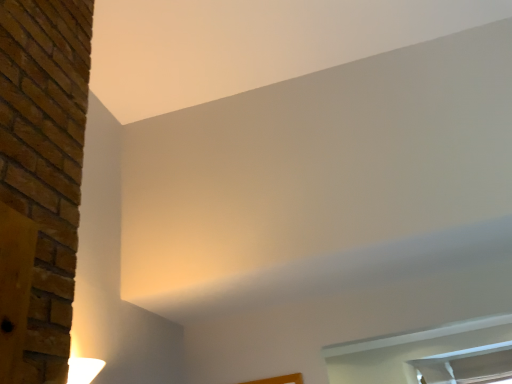
Describe the element at coordinates (429, 355) in the screenshot. Image resolution: width=512 pixels, height=384 pixels. I see `clear glass window at lower right, acting as the second window starting from the bottom` at that location.

The width and height of the screenshot is (512, 384). In order to click on clear glass window at lower right, acting as the second window starting from the bottom in this screenshot , I will do `click(429, 355)`.

Identify the location of clear glass window at lower right, marked as the first window in a bottom-to-top arrangement. (467, 365).

The width and height of the screenshot is (512, 384). What do you see at coordinates (467, 365) in the screenshot? I see `clear glass window at lower right, the 2th window from the top` at bounding box center [467, 365].

Locate an element on the screen. The image size is (512, 384). clear glass window at lower right, acting as the second window starting from the bottom is located at coordinates (429, 355).

Which object is positioned more to the right, clear glass window at lower right, acting as the second window starting from the bottom, or clear glass window at lower right, the 2th window from the top?

clear glass window at lower right, the 2th window from the top, is more to the right.

Who is more distant, clear glass window at lower right, which appears as the 1th window when viewed from the top, or clear glass window at lower right, marked as the first window in a bottom-to-top arrangement?

clear glass window at lower right, marked as the first window in a bottom-to-top arrangement.

Which is closer, (437, 328) or (496, 345)?

Clearly, point (437, 328) is closer to the camera than point (496, 345).

From the image's perspective, is clear glass window at lower right, acting as the second window starting from the bottom, over clear glass window at lower right, marked as the first window in a bottom-to-top arrangement?

Yes.

From a real-world perspective, which object rests below the other?

In real-world perspective, clear glass window at lower right, marked as the first window in a bottom-to-top arrangement, is lower.

Can you confirm if clear glass window at lower right, which appears as the 1th window when viewed from the top, is wider than clear glass window at lower right, marked as the first window in a bottom-to-top arrangement?

Yes.

In the scene shown: Is clear glass window at lower right, acting as the second window starting from the bottom, taller than clear glass window at lower right, marked as the first window in a bottom-to-top arrangement?

No.

Which of these two, clear glass window at lower right, which appears as the 1th window when viewed from the top, or clear glass window at lower right, marked as the first window in a bottom-to-top arrangement, is bigger?

With larger size is clear glass window at lower right, which appears as the 1th window when viewed from the top.

Can clear glass window at lower right, marked as the first window in a bottom-to-top arrangement, be found inside clear glass window at lower right, acting as the second window starting from the bottom?

Actually, clear glass window at lower right, marked as the first window in a bottom-to-top arrangement, is outside clear glass window at lower right, acting as the second window starting from the bottom.

Are clear glass window at lower right, acting as the second window starting from the bottom, and clear glass window at lower right, the 2th window from the top, located far from each other?

No, clear glass window at lower right, acting as the second window starting from the bottom, is in close proximity to clear glass window at lower right, the 2th window from the top.

Is clear glass window at lower right, marked as the first window in a bottom-to-top arrangement, at the back of clear glass window at lower right, which appears as the 1th window when viewed from the top?

clear glass window at lower right, which appears as the 1th window when viewed from the top, is not turned away from clear glass window at lower right, marked as the first window in a bottom-to-top arrangement.

How much distance is there between clear glass window at lower right, acting as the second window starting from the bottom, and clear glass window at lower right, marked as the first window in a bottom-to-top arrangement?

They are 3.70 inches apart.

The width and height of the screenshot is (512, 384). I want to click on window that appears behind the clear glass window at lower right, acting as the second window starting from the bottom, so click(x=467, y=365).

Which object is positioned more to the left, clear glass window at lower right, the 2th window from the top, or clear glass window at lower right, which appears as the 1th window when viewed from the top?

clear glass window at lower right, which appears as the 1th window when viewed from the top, is more to the left.

Which object is further away from the camera taking this photo, clear glass window at lower right, marked as the first window in a bottom-to-top arrangement, or clear glass window at lower right, acting as the second window starting from the bottom?

clear glass window at lower right, marked as the first window in a bottom-to-top arrangement, is more distant.

Does point (495, 348) appear closer or farther from the camera than point (429, 380)?

Point (495, 348) is positioned closer to the camera compared to point (429, 380).

From the image's perspective, between clear glass window at lower right, marked as the first window in a bottom-to-top arrangement, and clear glass window at lower right, acting as the second window starting from the bottom, who is located below?

clear glass window at lower right, marked as the first window in a bottom-to-top arrangement, from the image's perspective.

From a real-world perspective, is clear glass window at lower right, marked as the first window in a bottom-to-top arrangement, beneath clear glass window at lower right, acting as the second window starting from the bottom?

Yes, from a real-world perspective, clear glass window at lower right, marked as the first window in a bottom-to-top arrangement, is below clear glass window at lower right, acting as the second window starting from the bottom.

Which of these two, clear glass window at lower right, marked as the first window in a bottom-to-top arrangement, or clear glass window at lower right, acting as the second window starting from the bottom, is thinner?

clear glass window at lower right, marked as the first window in a bottom-to-top arrangement, is thinner.

Is clear glass window at lower right, the 2th window from the top, shorter than clear glass window at lower right, acting as the second window starting from the bottom?

No, clear glass window at lower right, the 2th window from the top, is not shorter than clear glass window at lower right, acting as the second window starting from the bottom.

Looking at this image, considering the relative sizes of clear glass window at lower right, marked as the first window in a bottom-to-top arrangement, and clear glass window at lower right, acting as the second window starting from the bottom, in the image provided, is clear glass window at lower right, marked as the first window in a bottom-to-top arrangement, bigger than clear glass window at lower right, acting as the second window starting from the bottom,?

No.

Is clear glass window at lower right, acting as the second window starting from the bottom, inside clear glass window at lower right, the 2th window from the top?

That's incorrect, clear glass window at lower right, acting as the second window starting from the bottom, is not inside clear glass window at lower right, the 2th window from the top.

Is clear glass window at lower right, marked as the first window in a bottom-to-top arrangement, far away from clear glass window at lower right, acting as the second window starting from the bottom?

clear glass window at lower right, marked as the first window in a bottom-to-top arrangement, is near clear glass window at lower right, acting as the second window starting from the bottom, not far away.

Is clear glass window at lower right, acting as the second window starting from the bottom, at the back of clear glass window at lower right, marked as the first window in a bottom-to-top arrangement?

No, clear glass window at lower right, acting as the second window starting from the bottom, is not at the back of clear glass window at lower right, marked as the first window in a bottom-to-top arrangement.

What's the angular difference between clear glass window at lower right, marked as the first window in a bottom-to-top arrangement, and clear glass window at lower right, which appears as the 1th window when viewed from the top,'s facing directions?

They differ by 1.58 degrees in their facing directions.

Find the location of a particular element. window in front of the clear glass window at lower right, marked as the first window in a bottom-to-top arrangement is located at coordinates (429, 355).

This screenshot has width=512, height=384. I want to click on window below the clear glass window at lower right, acting as the second window starting from the bottom (from a real-world perspective), so click(x=467, y=365).

The height and width of the screenshot is (384, 512). Find the location of `window that is above the clear glass window at lower right, the 2th window from the top (from the image's perspective)`. window that is above the clear glass window at lower right, the 2th window from the top (from the image's perspective) is located at coordinates (429, 355).